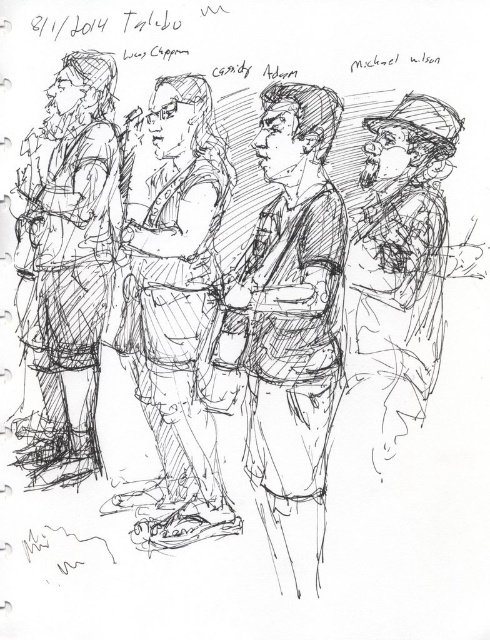
You are an artist trying to draw the scene. You want to ensure the smooth brown vest at center and the matte black jacket at left are proportionally accurate. Which one should you draw taller?

The smooth brown vest at center should be drawn taller since it has a greater height compared to the matte black jacket at left according to the description.

Looking at this image, you are standing at the origin point in the image. Which of the two points, point (315, 154) or point (364, 285), is closer to you?

Point (315, 154) is in front of point (364, 285), so it is closer to you.

You are an artist trying to draw the scene. You want to ensure the proportions between the matte black jacket at left and the shiny metallic hat at right are accurate. Which object should you draw with a narrower width?

The matte black jacket at left should be drawn with a narrower width since it is thinner than the shiny metallic hat at right according to the description.